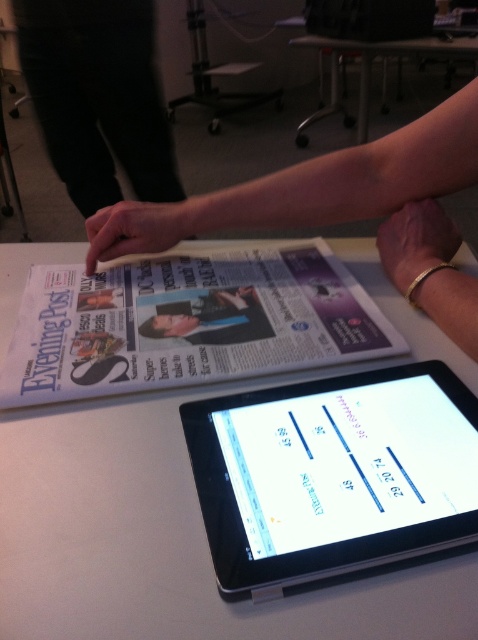
Who is more forward, [251,182] or [443,51]?

Positioned in front is point [251,182].

Which is more to the right, smooth skin at upper center or white plastic table at upper center?

white plastic table at upper center

Where is `smooth skin at upper center`? This screenshot has height=640, width=478. smooth skin at upper center is located at coordinates (344, 209).

Is white glossy table at center taller than black fabric pants at upper left?

In fact, white glossy table at center may be shorter than black fabric pants at upper left.

Is point (142, 614) positioned before point (131, 72)?

Yes, it is in front of point (131, 72).

Which is behind, point (30, 458) or point (71, 129)?

The point (71, 129) is more distant.

What are the coordinates of `white glossy table at center` in the screenshot? It's located at (185, 520).

Who is taller, gold bracelet at upper right or matte black finger at upper center?

gold bracelet at upper right is taller.

Is point (401, 291) more distant than point (163, 230)?

No.

Identify the location of gold bracelet at upper right. (415, 241).